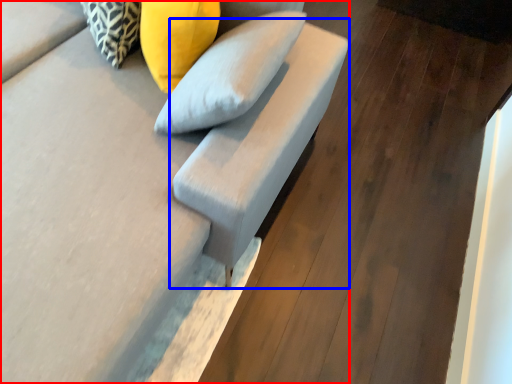
Question: Which point is further to the camera, furniture (highlighted by a red box) or armchair (highlighted by a blue box)?

Choices:
 (A) furniture
 (B) armchair

Answer: (B)